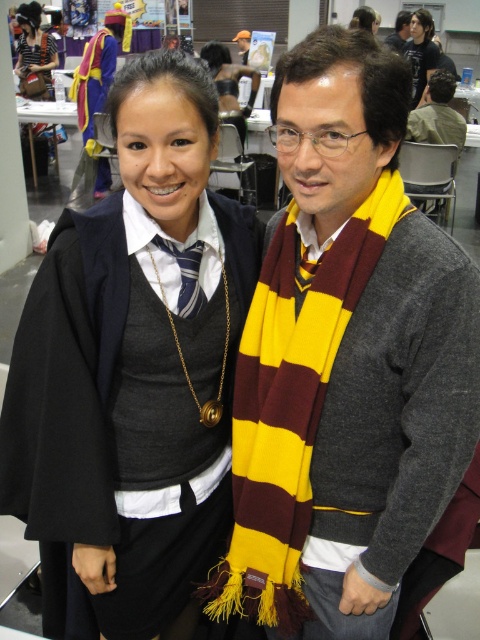
Please provide the coordinates of the matte black cape at center in the image.

The coordinates of the matte black cape at center are at point (134, 362).

You are a photographer at a convention and need to capture a photo where both the maroon and yellow striped scarf at right and the matte black hair at upper center are in focus. The camera you are using has a depth of field that can only sharply focus on objects within a 5 meter range. Will both subjects be in focus?

The maroon and yellow striped scarf at right is 5.34 meters from matte black hair at upper center. Since the distance between them exceeds the camera s 5 meter depth of field range, the two subjects cannot both be in focus simultaneously.